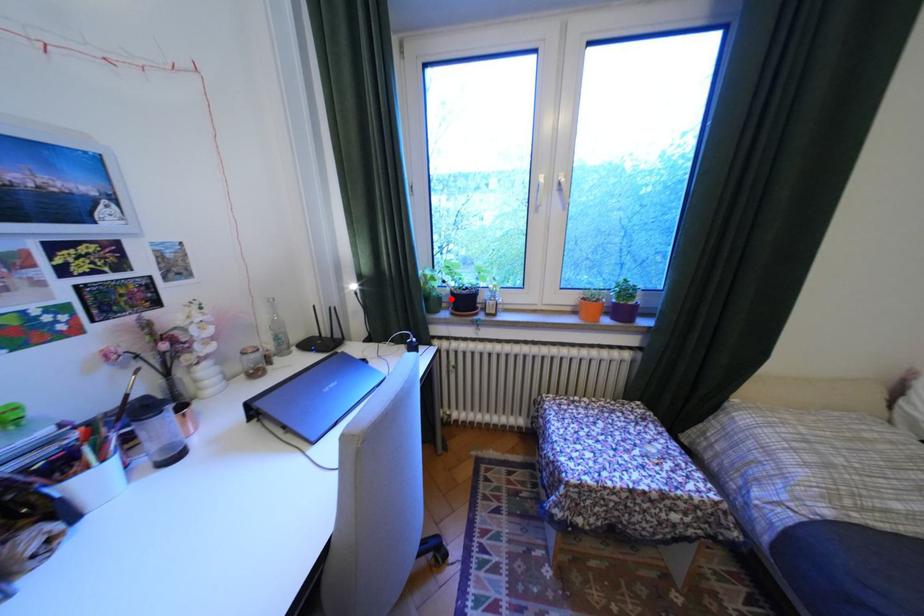
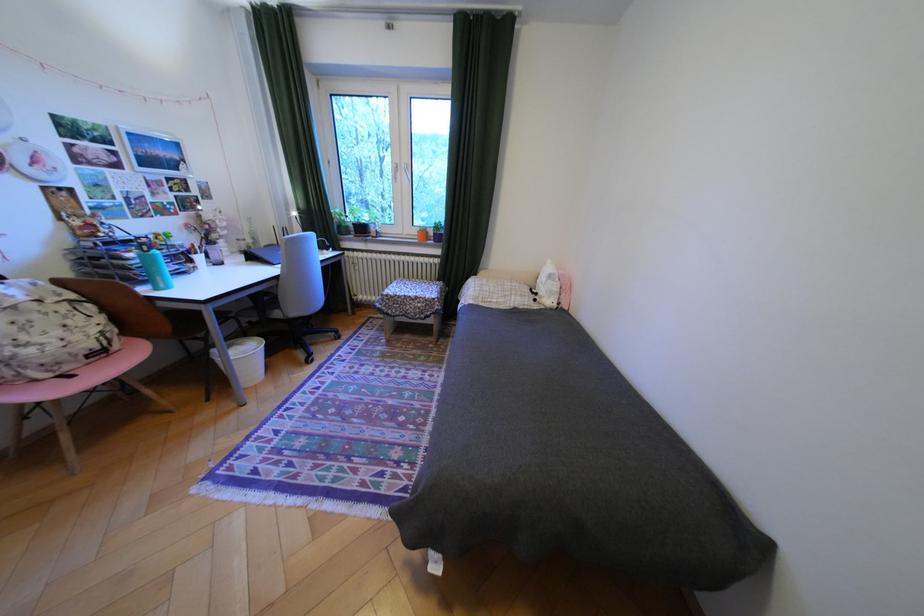
Question: I am providing you with two images of the same scene from different viewpoints. Image1 has a red point marked. In image2, the corresponding 3D location appears at what relative position? Reply with the corresponding letter.

Choices:
 (A) Closer
 (B) Farther

Answer: (A)